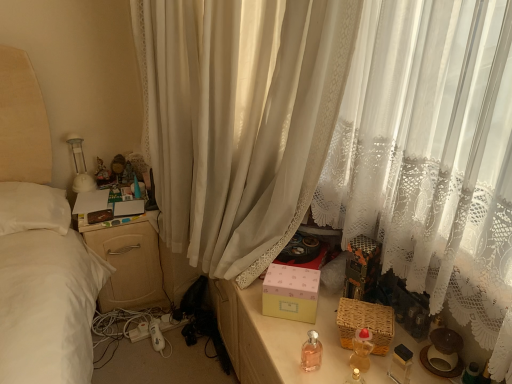
Question: Is white sheer curtain at center to the left of pink glass bottle at center, which is counted as the 2th baby bottle, starting from the right, from the viewer's perspective?

Choices:
 (A) yes
 (B) no

Answer: (A)

Question: Is white sheer curtain at center far from pink glass bottle at center, which is counted as the 2th baby bottle, starting from the right?

Choices:
 (A) no
 (B) yes

Answer: (A)

Question: Is white sheer curtain at center not inside pink glass bottle at center, the first baby bottle positioned from the left?

Choices:
 (A) no
 (B) yes

Answer: (B)

Question: Considering the relative sizes of white sheer curtain at center and pink glass bottle at center, which is counted as the 2th baby bottle, starting from the right, in the image provided, is white sheer curtain at center shorter than pink glass bottle at center, which is counted as the 2th baby bottle, starting from the right,?

Choices:
 (A) no
 (B) yes

Answer: (A)

Question: Is white sheer curtain at center at the right side of pink glass bottle at center, which is counted as the 2th baby bottle, starting from the right?

Choices:
 (A) yes
 (B) no

Answer: (B)

Question: Can you confirm if white sheer curtain at center is wider than pink glass bottle at center, the first baby bottle positioned from the left?

Choices:
 (A) yes
 (B) no

Answer: (A)

Question: Is pink glass bottle at center, which is counted as the 2th baby bottle, starting from the right, at the right side of matte plastic figurine at upper left?

Choices:
 (A) no
 (B) yes

Answer: (B)

Question: Considering the relative positions of pink glass bottle at center, which is counted as the 2th baby bottle, starting from the right, and matte plastic figurine at upper left in the image provided, is pink glass bottle at center, which is counted as the 2th baby bottle, starting from the right, behind matte plastic figurine at upper left?

Choices:
 (A) yes
 (B) no

Answer: (B)

Question: Can you confirm if pink glass bottle at center, the first baby bottle positioned from the left, is positioned to the left of matte plastic figurine at upper left?

Choices:
 (A) no
 (B) yes

Answer: (A)

Question: From the image's perspective, is pink glass bottle at center, which is counted as the 2th baby bottle, starting from the right, over matte plastic figurine at upper left?

Choices:
 (A) yes
 (B) no

Answer: (B)

Question: From the image's perspective, does pink glass bottle at center, which is counted as the 2th baby bottle, starting from the right, appear lower than matte plastic figurine at upper left?

Choices:
 (A) yes
 (B) no

Answer: (A)

Question: Is pink glass bottle at center, which is counted as the 2th baby bottle, starting from the right, bigger than matte plastic figurine at upper left?

Choices:
 (A) yes
 (B) no

Answer: (B)

Question: Is translucent plastic baby bottle at lower right, placed as the first baby bottle when sorted from right to left, facing away from woven brown basket at lower right?

Choices:
 (A) yes
 (B) no

Answer: (A)